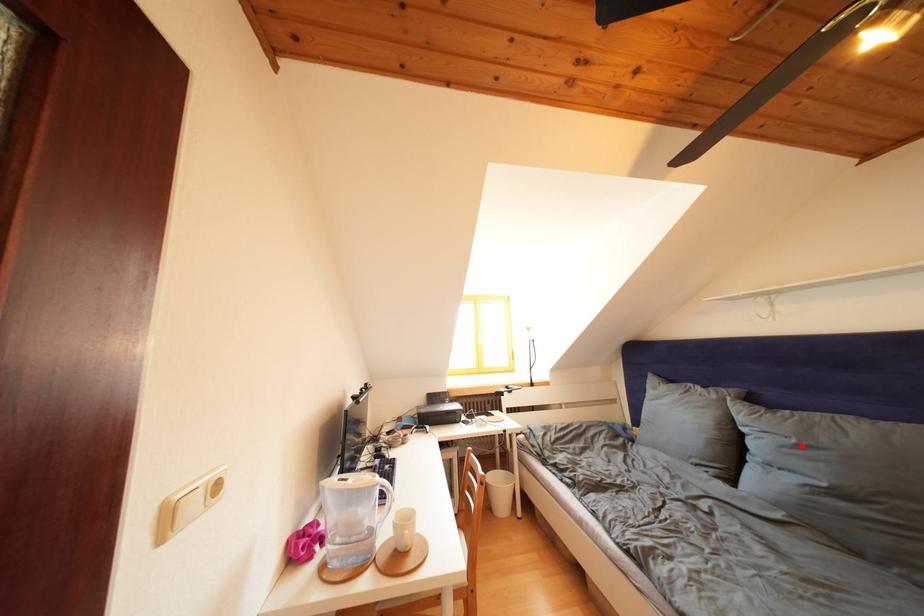
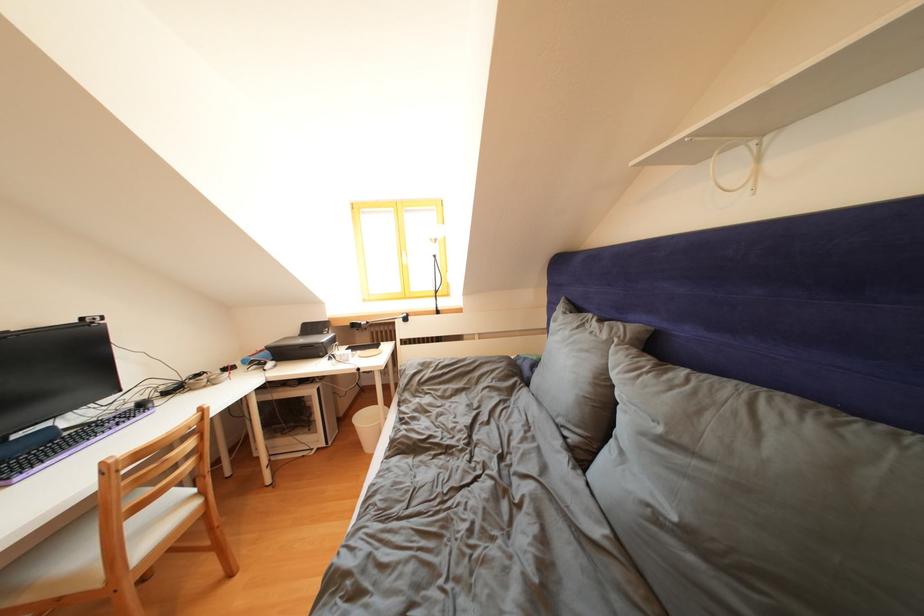
The point at the highlighted location is marked in the first image. Where is the corresponding point in the second image?

(667, 435)